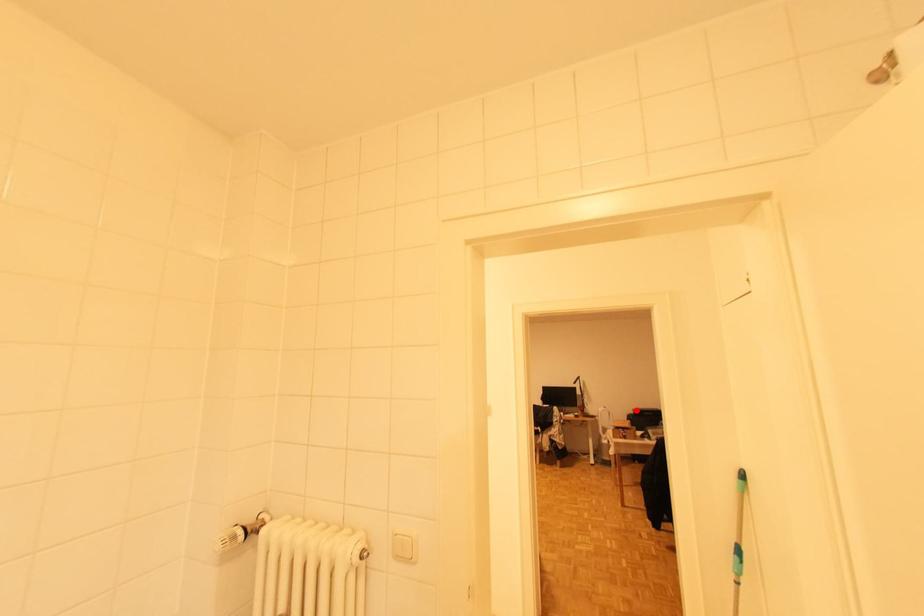
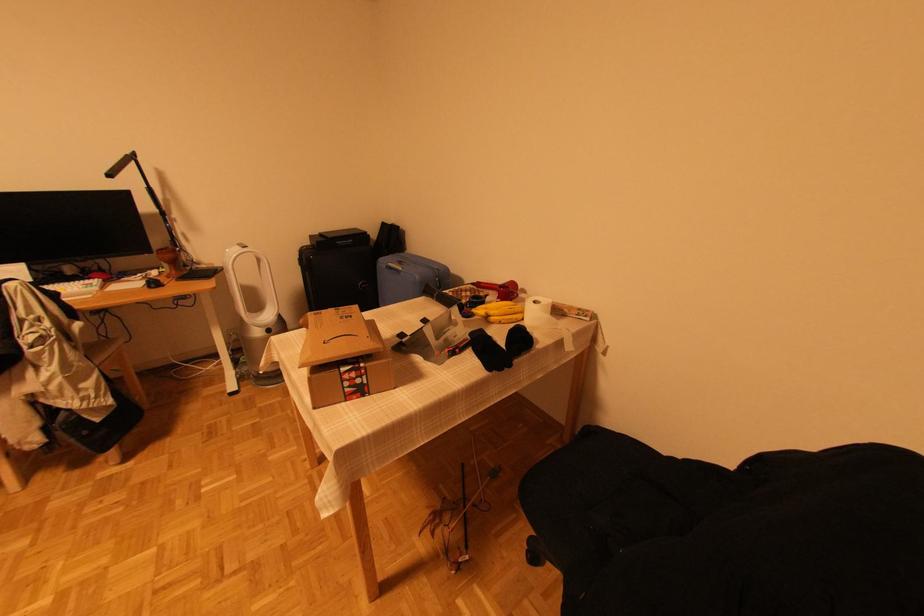
Question: I am providing you with two images of the same scene from different viewpoints. Given a red point in image1, look at the same physical point in image2. Is it:

Choices:
 (A) Closer to the viewpoint
 (B) Farther from the viewpoint

Answer: (A)